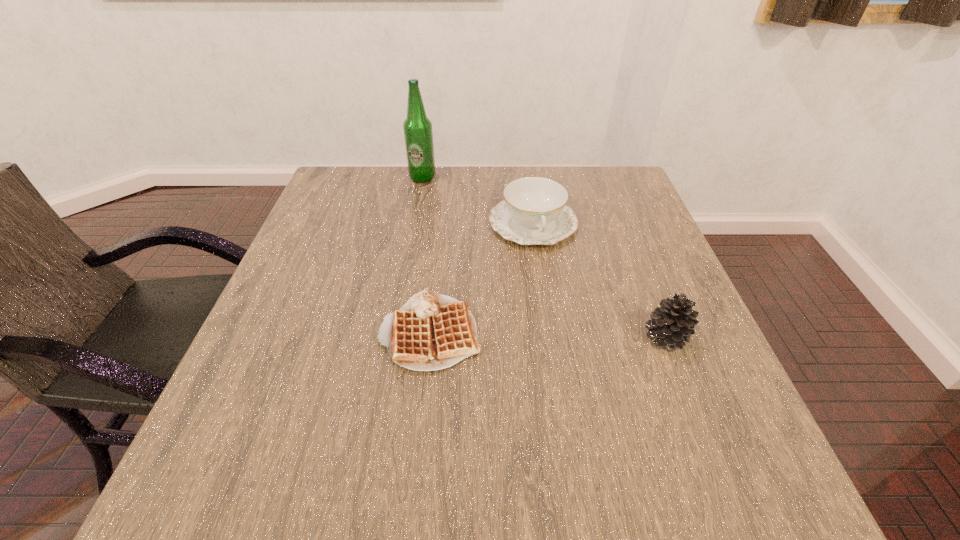
Identify the location of vacant space on the desktop that is between the shortest object and the rightmost object and is positioned on the handle side of the third nearest object. (569, 335).

Identify the location of free space on the desktop that is between the shortest object and the rightmost object and is positioned on the label of the farthest object. point(515,334).